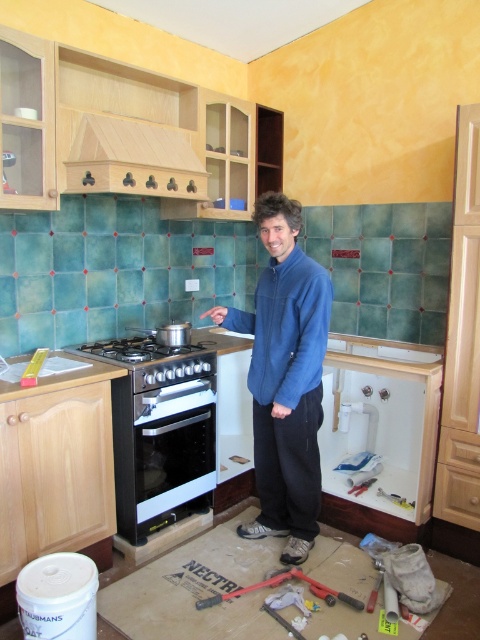
You are a contractor assessing the kitchen layout. You see the blue fleece jacket at center and the matte black gas stove at center. Which object is taller?

The blue fleece jacket at center is taller than the matte black gas stove at center.

You are a contractor working in the kitchen and need to place both the blue fleece jacket at center and the metallic silver screwdriver at lower center on a narrow shelf. Which item should you place first to ensure they both fit?

The metallic silver screwdriver at lower center should be placed first because it is narrower than the blue fleece jacket at center, allowing both items to fit on the narrow shelf.

You are a contractor inspecting the kitchen renovation. You notice the blue fleece jacket at center and the matte black gas stove at center. Which object is closer to you from your current viewpoint?

The blue fleece jacket at center is closer to you because it is in front of the matte black gas stove at center.